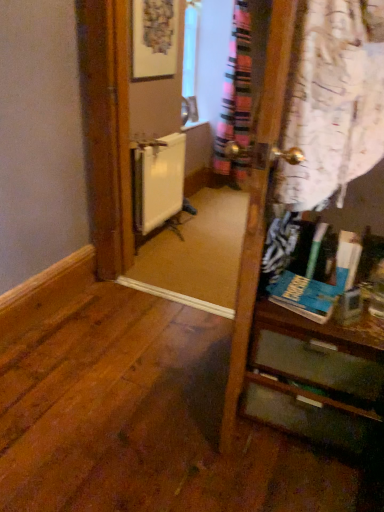
Question: From the image's perspective, is matte wooden vanity at right located above or below white matte radiator at center?

Choices:
 (A) above
 (B) below

Answer: (B)

Question: From a real-world perspective, is matte wooden vanity at right positioned above or below white matte radiator at center?

Choices:
 (A) above
 (B) below

Answer: (B)

Question: Is matte wooden vanity at right wider or thinner than white matte radiator at center?

Choices:
 (A) thin
 (B) wide

Answer: (B)

Question: Is white matte radiator at center inside the boundaries of matte wooden vanity at right, or outside?

Choices:
 (A) outside
 (B) inside

Answer: (A)

Question: Considering their positions, is white matte radiator at center located in front of or behind matte wooden vanity at right?

Choices:
 (A) behind
 (B) front

Answer: (A)

Question: In terms of size, does white matte radiator at center appear bigger or smaller than matte wooden vanity at right?

Choices:
 (A) big
 (B) small

Answer: (B)

Question: Is point (170, 141) closer or farther from the camera than point (319, 415)?

Choices:
 (A) closer
 (B) farther

Answer: (B)